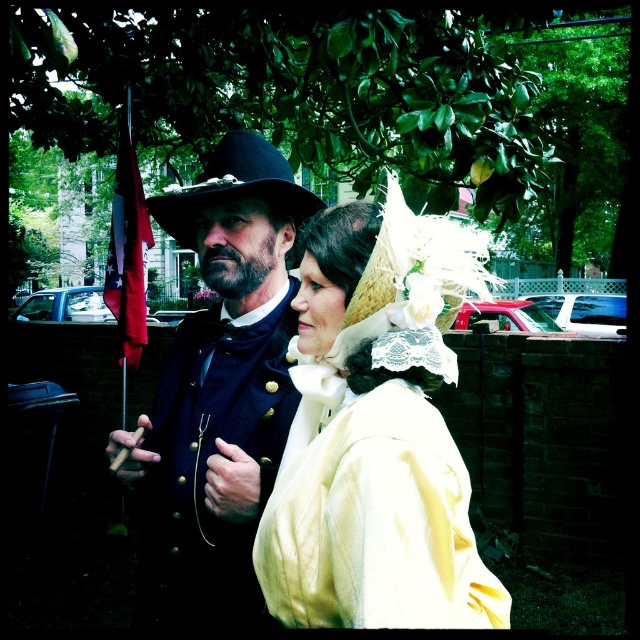
Based on the photo, you are a photographer aiming to capture a closeup shot of the matte white lace bonnet at center. Given that your camera lens has a minimum focusing distance of 90 centimeters, will you be able to achieve the desired closeup without moving the bonnet closer?

The matte white lace bonnet at center is currently 86.75 centimeters away from the camera, which is less than the lens minimum focusing distance of 90 centimeters. Therefore, the camera cannot focus on the bonnet at this distance, so you need to either move the camera back or adjust the lens settings to capture the closeup.